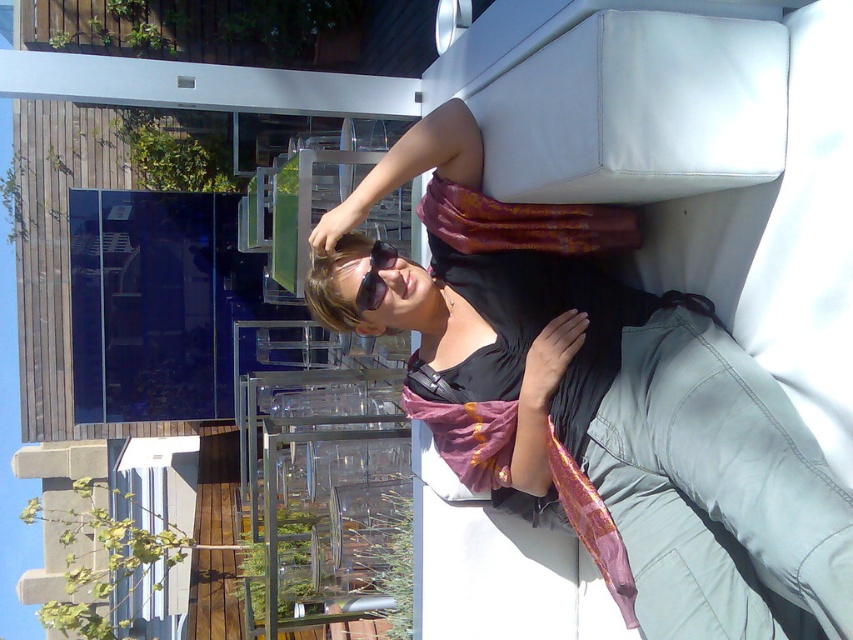
You are a delivery person who needs to place a small package between the matte black scarf at center and the black plastic goggles at upper center. The package is 50 centimeters long. Can you fit it between them without moving either object?

The distance between the matte black scarf at center and the black plastic goggles at upper center is 46.60 centimeters. Since the package is 50 centimeters long, it is longer than the available space, so it cannot be placed between them without moving the objects.

You are a photographer trying to capture a closeup of the matte black scarf at center. Your camera is positioned where the photographer in the image is. Can you get a clear closeup shot without moving the camera?

The matte black scarf at center and camera are 5.12 feet apart from each other. Since 5.12 feet is a reasonable distance for a closeup shot, yes, you can capture a clear closeup of the matte black scarf at center without moving the camera.

In the image, there is a person wearing a black top and a pink scarf at center. The coordinates point at (x=601, y=406) are mentioned. Based on the scene description, can you determine what object the point is pointing to?

The point at coordinates (x=601, y=406) is on the matte black scarf at center.